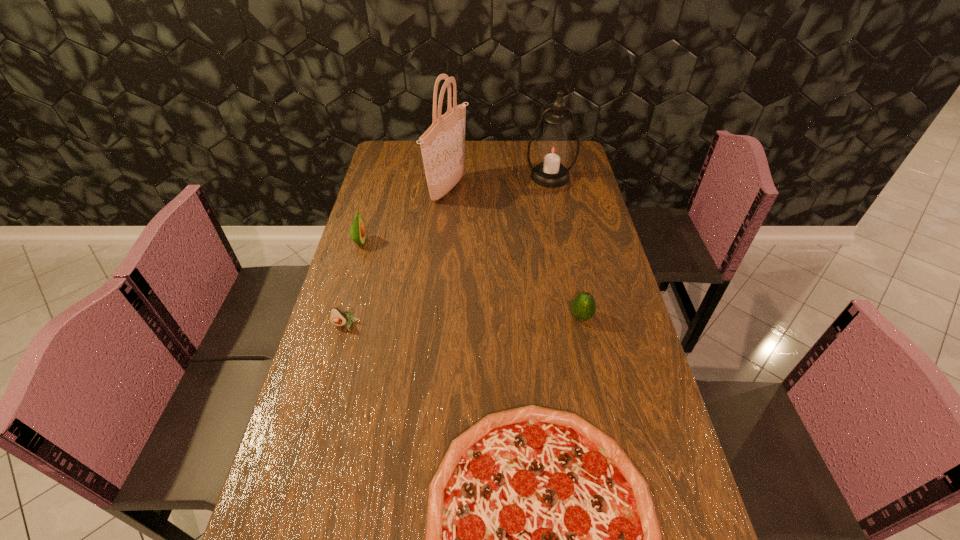
At what (x,y) coordinates should I click in order to perform the action: click on free space between the second shortest object and the oil lamp. Please return your answer as a coordinate pair (x, y). The width and height of the screenshot is (960, 540). Looking at the image, I should click on (447, 251).

Find the location of a particular element. vacant space in between the tallest avocado and the second shortest object is located at coordinates (353, 284).

Identify the location of free area in between the farthest avocado and the third shortest object. This screenshot has width=960, height=540. (470, 280).

Where is `empty space that is in between the fourth nearest object and the second shortest avocado`? empty space that is in between the fourth nearest object and the second shortest avocado is located at coordinates click(470, 280).

You are a GUI agent. You are given a task and a screenshot of the screen. Output one action in this format:
    pyautogui.click(x=<x>, y=<y>)
    Task: Click on the vacant area between the shopping bag and the oil lamp
    Image resolution: width=960 pixels, height=540 pixels.
    Given the screenshot: What is the action you would take?
    pyautogui.click(x=499, y=183)

Find the location of `the fifth closest object to the oil lamp`. the fifth closest object to the oil lamp is located at coordinates tap(542, 539).

Image resolution: width=960 pixels, height=540 pixels. Find the location of `object identified as the fourth closest to the shortest avocado`. object identified as the fourth closest to the shortest avocado is located at coordinates (583, 307).

Locate an element on the screen. The image size is (960, 540). avocado object that ranks as the closest to the oil lamp is located at coordinates (583, 307).

Select which avocado appears as the third closest to the pizza. Please provide its 2D coordinates. Your answer should be formatted as a tuple, i.e. [(x, y)], where the tuple contains the x and y coordinates of a point satisfying the conditions above.

[(357, 230)]

Locate an element on the screen. The height and width of the screenshot is (540, 960). free space that satisfies the following two spatial constraints: 1. on the back side of the shopping bag; 2. on the left side of the oil lamp is located at coordinates (449, 177).